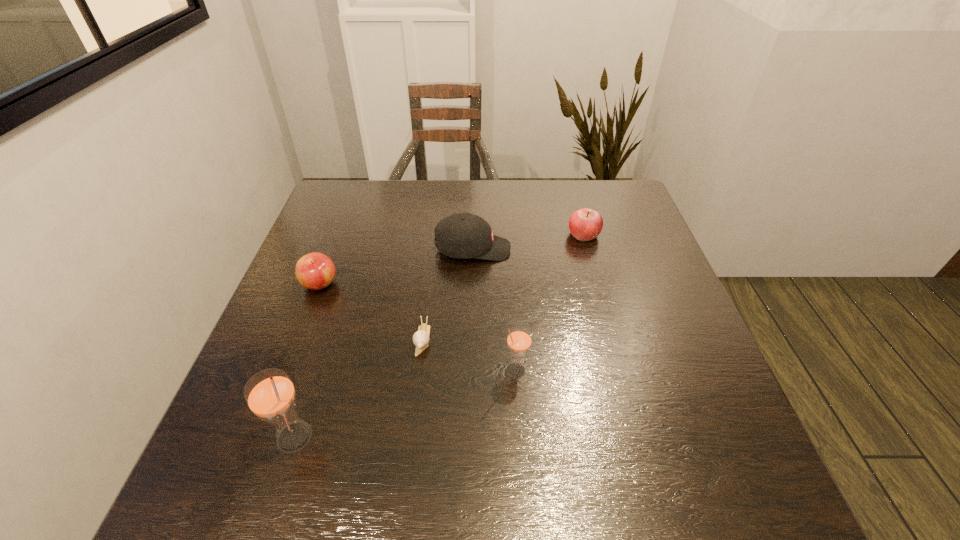
Locate an element on the screen. The image size is (960, 540). object that is the fourth closest one to the rightmost object is located at coordinates (315, 271).

Locate an element on the screen. vacant space that satisfies the following two spatial constraints: 1. on the front side of the third farthest object; 2. on the right side of the right straw is located at coordinates (287, 369).